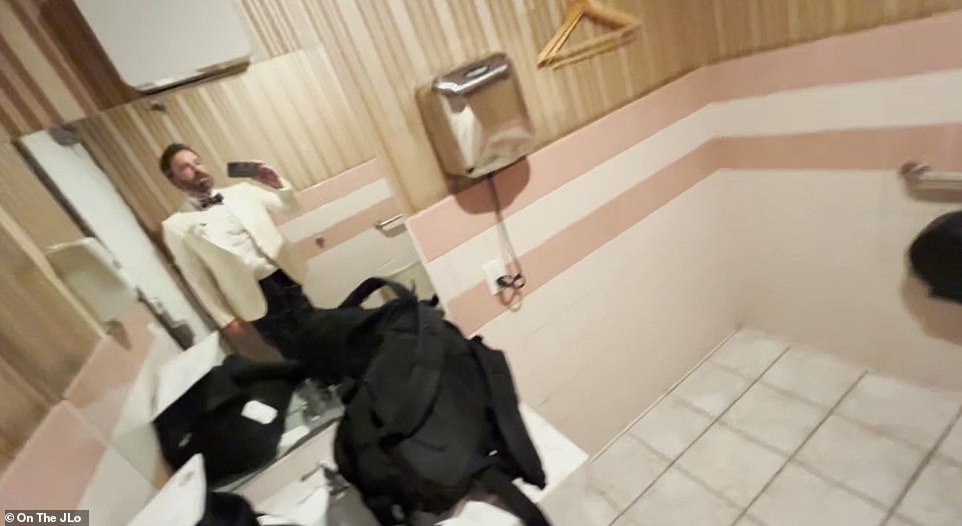
I want to click on tile, so click(x=696, y=432).